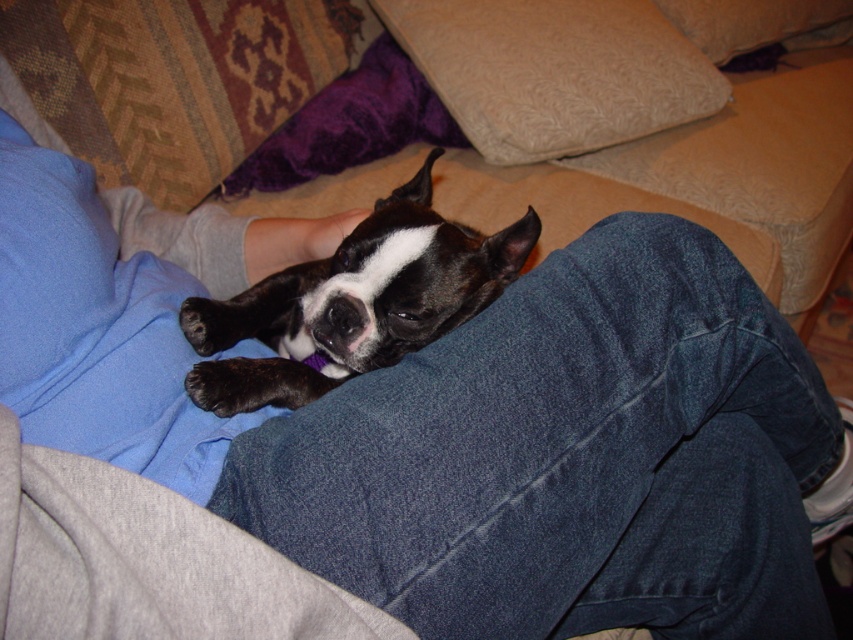
Question: Which object is closer to the camera taking this photo?

Choices:
 (A) beige textured pillow at upper center
 (B) black matte dog at center

Answer: (B)

Question: Observing the image, what is the correct spatial positioning of black matte dog at center in reference to beige textured pillow at upper center?

Choices:
 (A) right
 (B) left

Answer: (B)

Question: Among these objects, which one is farthest from the camera?

Choices:
 (A) blue fabric pillow at upper left
 (B) beige textured pillow at upper center

Answer: (B)

Question: Which of the following is the farthest from the observer?

Choices:
 (A) (74, 195)
 (B) (404, 275)

Answer: (B)

Question: Is the position of black matte dog at center more distant than that of blue fabric pillow at upper left?

Choices:
 (A) no
 (B) yes

Answer: (B)

Question: Can you confirm if black matte dog at center is positioned to the right of blue fabric pillow at upper left?

Choices:
 (A) yes
 (B) no

Answer: (A)